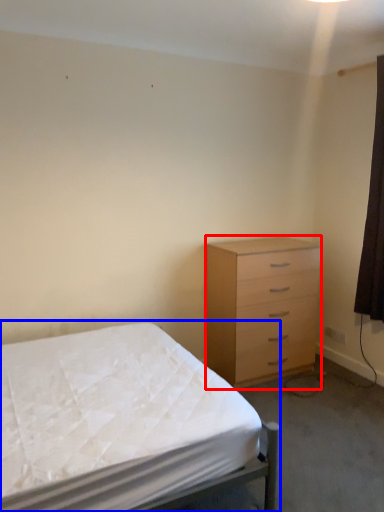
Question: Which point is further to the camera, chest of drawers (highlighted by a red box) or bed (highlighted by a blue box)?

Choices:
 (A) chest of drawers
 (B) bed

Answer: (A)